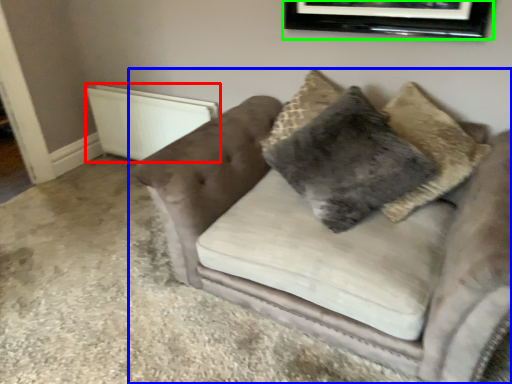
Question: Based on their relative distances, which object is farther from radiator (highlighted by a red box)? Choose from studio couch (highlighted by a blue box) and picture frame (highlighted by a green box).

Choices:
 (A) studio couch
 (B) picture frame

Answer: (B)